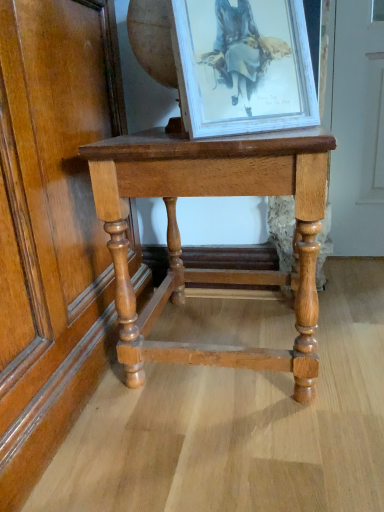
In order to face light brown wood table at center, should I rotate leftwards or rightwards?

To face it directly, rotate right by 3.971 degrees.

What do you see at coordinates (180, 239) in the screenshot? This screenshot has width=384, height=512. I see `light brown wood table at center` at bounding box center [180, 239].

Find the location of a particular element. The image size is (384, 512). light brown wood table at center is located at coordinates (180, 239).

Where is `white wood picture frame at upper center`? This screenshot has width=384, height=512. white wood picture frame at upper center is located at coordinates (245, 65).

Describe the element at coordinates (245, 65) in the screenshot. This screenshot has width=384, height=512. I see `white wood picture frame at upper center` at that location.

You are a GUI agent. You are given a task and a screenshot of the screen. Output one action in this format:
    pyautogui.click(x=<x>, y=<y>)
    Task: Click on the light brown wood table at center
    The height and width of the screenshot is (512, 384).
    Given the screenshot: What is the action you would take?
    pyautogui.click(x=180, y=239)

Considering the relative positions of light brown wood table at center and white wood picture frame at upper center in the image provided, is light brown wood table at center to the right of white wood picture frame at upper center from the viewer's perspective?

No.

Between light brown wood table at center and white wood picture frame at upper center, which one is positioned in front?

white wood picture frame at upper center is in front.

Is point (251, 193) positioned before point (276, 119)?

Yes.

From the image's perspective, is light brown wood table at center above white wood picture frame at upper center?

No, from the image's perspective, light brown wood table at center is not above white wood picture frame at upper center.

From a real-world perspective, who is located lower, light brown wood table at center or white wood picture frame at upper center?

light brown wood table at center, from a real-world perspective.

In terms of width, does light brown wood table at center look wider or thinner when compared to white wood picture frame at upper center?

Clearly, light brown wood table at center has more width compared to white wood picture frame at upper center.

Considering the sizes of objects light brown wood table at center and white wood picture frame at upper center in the image provided, who is shorter, light brown wood table at center or white wood picture frame at upper center?

Standing shorter between the two is white wood picture frame at upper center.

Looking at this image, is light brown wood table at center bigger than white wood picture frame at upper center?

Yes.

Looking at this image, is white wood picture frame at upper center inside light brown wood table at center?

No, white wood picture frame at upper center is not inside light brown wood table at center.

Would you consider light brown wood table at center to be distant from white wood picture frame at upper center?

light brown wood table at center is actually quite close to white wood picture frame at upper center.

Is light brown wood table at center looking in the opposite direction of white wood picture frame at upper center?

light brown wood table at center does not have its back to white wood picture frame at upper center.

Find the location of a particular element. table that is on the left side of white wood picture frame at upper center is located at coordinates (180, 239).

Between white wood picture frame at upper center and light brown wood table at center, which one appears on the left side from the viewer's perspective?

light brown wood table at center.

Does white wood picture frame at upper center come in front of light brown wood table at center?

Yes.

From the picture: Which point is more distant from viewer, (x=295, y=80) or (x=244, y=142)?

The point (x=295, y=80) is farther.

From the image's perspective, is white wood picture frame at upper center below light brown wood table at center?

No.

From a real-world perspective, is white wood picture frame at upper center below light brown wood table at center?

No.

Can you confirm if white wood picture frame at upper center is thinner than light brown wood table at center?

Correct, the width of white wood picture frame at upper center is less than that of light brown wood table at center.

Between white wood picture frame at upper center and light brown wood table at center, which one has more height?

Standing taller between the two is light brown wood table at center.

Considering the sizes of white wood picture frame at upper center and light brown wood table at center in the image, is white wood picture frame at upper center bigger or smaller than light brown wood table at center?

Considering their sizes, white wood picture frame at upper center takes up less space than light brown wood table at center.

Do you think white wood picture frame at upper center is within light brown wood table at center, or outside of it?

white wood picture frame at upper center cannot be found inside light brown wood table at center.

Is there a large distance between white wood picture frame at upper center and light brown wood table at center?

They are positioned close to each other.

Is white wood picture frame at upper center looking in the opposite direction of light brown wood table at center?

No, white wood picture frame at upper center is not facing away from light brown wood table at center.

Can you tell me how much white wood picture frame at upper center and light brown wood table at center differ in facing direction?

They differ by 29.9 degrees in their facing directions.

Locate an element on the screen. table on the left of the white wood picture frame at upper center is located at coordinates (180, 239).

Find the location of a particular element. This screenshot has height=512, width=384. picture frame above the light brown wood table at center (from the image's perspective) is located at coordinates (245, 65).

The image size is (384, 512). In order to click on picture frame that appears above the light brown wood table at center (from a real-world perspective) in this screenshot , I will do 245,65.